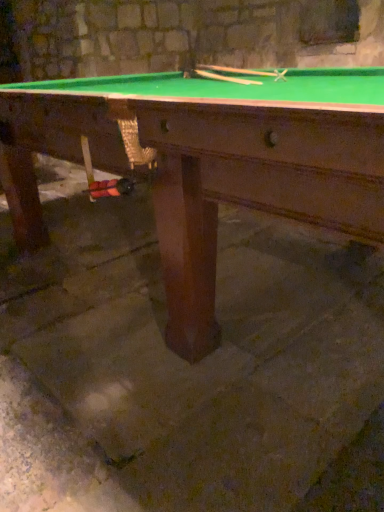
Question: Is wooden smooth cue at upper center, acting as the first cue starting from the left, taller or shorter than wooden smooth cue at upper center, arranged as the 1th cue when viewed from the right?

Choices:
 (A) tall
 (B) short

Answer: (B)

Question: In terms of width, does wooden smooth cue at upper center, which is the 2th cue in right-to-left order, look wider or thinner when compared to wooden smooth cue at upper center, arranged as the 1th cue when viewed from the right?

Choices:
 (A) wide
 (B) thin

Answer: (B)

Question: Estimate the real-world distances between objects in this image. Which object is closer to the brown stone concrete at center?

Choices:
 (A) wooden smooth cue at upper center, arranged as the 1th cue when viewed from the right
 (B) wooden smooth cue at upper center, which is the 2th cue in right-to-left order

Answer: (B)

Question: Based on their relative distances, which object is farther from the brown stone concrete at center?

Choices:
 (A) wooden smooth cue at upper center, positioned as the 2th cue in left-to-right order
 (B) wooden smooth cue at upper center, acting as the first cue starting from the left

Answer: (A)